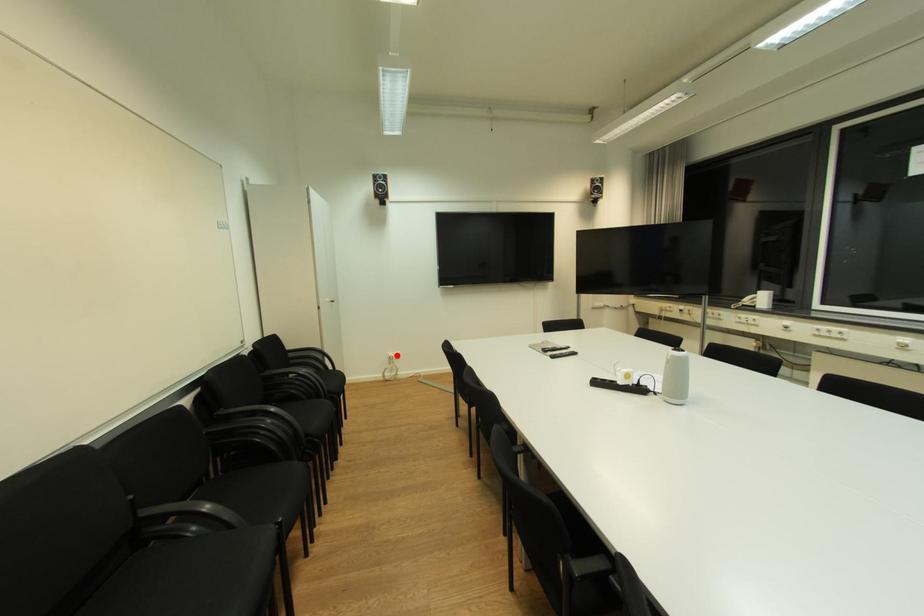
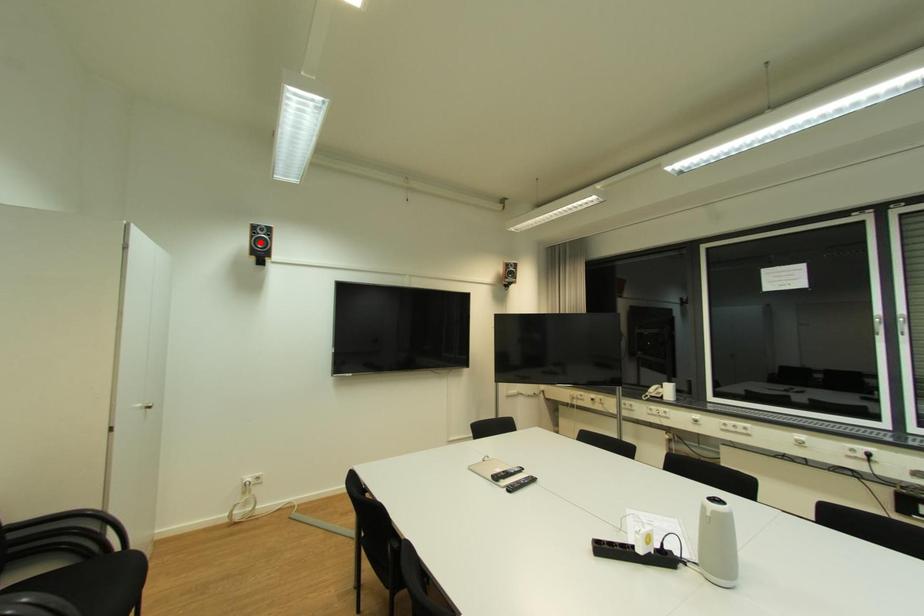
Consider the image. I am providing you with two images of the same scene from different viewpoints. A red point is marked on the first image and another point is marked on the second image. Are the points marked in image1 and image2 representing the same 3D position?

No